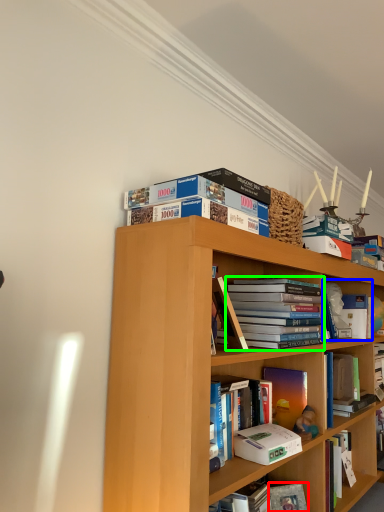
Question: Estimate the real-world distances between objects in this image. Which object is farther from paperback book (highlighted by a red box), book (highlighted by a blue box) or book (highlighted by a green box)?

Choices:
 (A) book
 (B) book

Answer: (A)